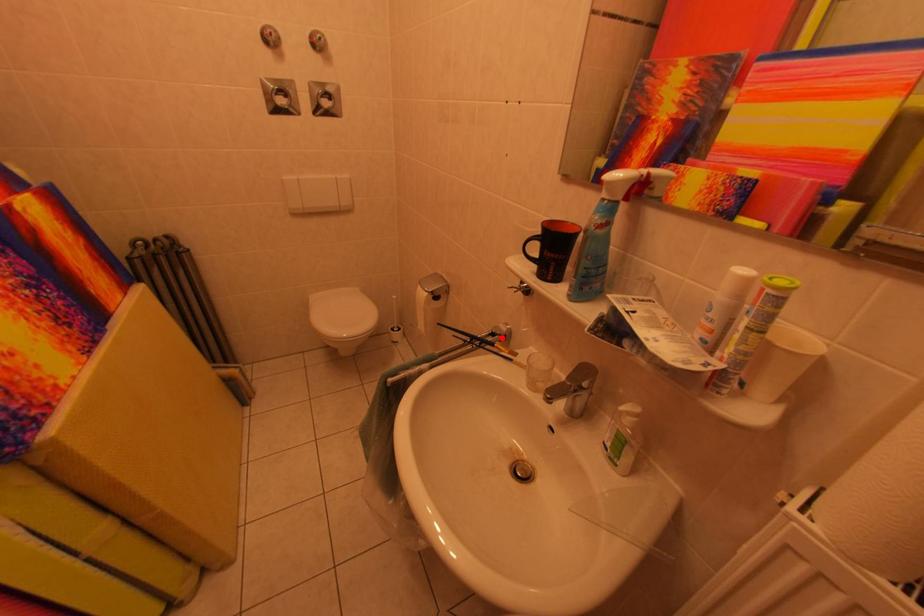
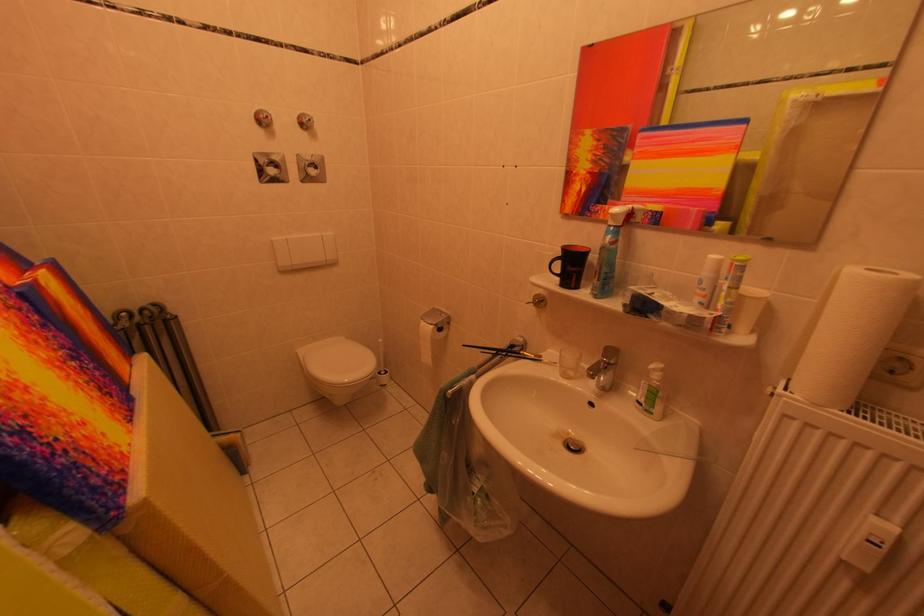
Where in the second image is the point corresponding to the highlighted location from the first image?

(520, 351)